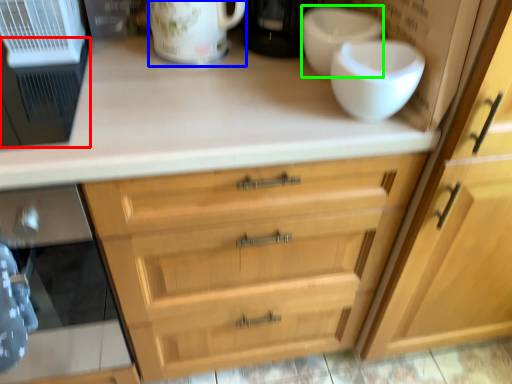
Question: Which object is positioned farthest from appliance (highlighted by a red box)? Select from mug (highlighted by a blue box) and basin (highlighted by a green box).

Choices:
 (A) mug
 (B) basin

Answer: (B)